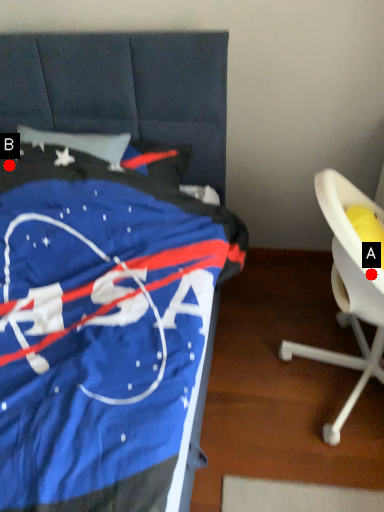
Question: Two points are circled on the image, labeled by A and B beside each circle. Which of the following is the farthest from the observer?

Choices:
 (A) A is further
 (B) B is further

Answer: (B)